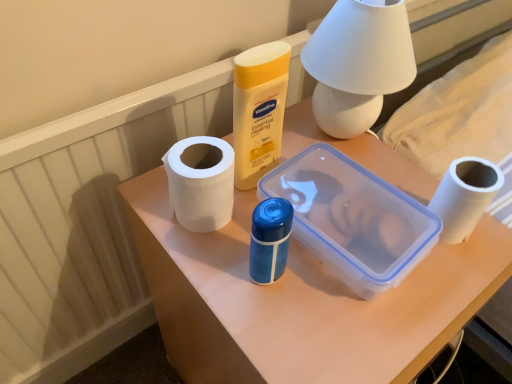
Question: Is the position of white matte paper towel at center-left less distant than that of white matte table lamp at upper center?

Choices:
 (A) no
 (B) yes

Answer: (A)

Question: Is white matte paper towel at center-left at the right side of white matte table lamp at upper center?

Choices:
 (A) yes
 (B) no

Answer: (B)

Question: From the image's perspective, does white matte paper towel at center-left appear higher than white matte table lamp at upper center?

Choices:
 (A) no
 (B) yes

Answer: (A)

Question: Is the depth of white matte paper towel at center-left greater than that of white matte table lamp at upper center?

Choices:
 (A) yes
 (B) no

Answer: (A)

Question: Considering the relative sizes of white matte paper towel at center-left and white matte table lamp at upper center in the image provided, is white matte paper towel at center-left smaller than white matte table lamp at upper center?

Choices:
 (A) yes
 (B) no

Answer: (A)

Question: In terms of height, does white textured radiator at lower left look taller or shorter compared to white matte toilet paper at right?

Choices:
 (A) short
 (B) tall

Answer: (B)

Question: Relative to white matte toilet paper at right, is white textured radiator at lower left in front or behind?

Choices:
 (A) front
 (B) behind

Answer: (A)

Question: From a real-world perspective, is white textured radiator at lower left physically located above or below white matte toilet paper at right?

Choices:
 (A) above
 (B) below

Answer: (B)

Question: From the image's perspective, is white textured radiator at lower left above or below white matte toilet paper at right?

Choices:
 (A) above
 (B) below

Answer: (A)

Question: From their relative heights in the image, would you say white textured radiator at lower left is taller or shorter than white matte paper towel at center-left?

Choices:
 (A) tall
 (B) short

Answer: (A)

Question: Is point (178, 107) positioned closer to the camera than point (179, 155)?

Choices:
 (A) farther
 (B) closer

Answer: (A)

Question: In terms of width, does white textured radiator at lower left look wider or thinner when compared to white matte paper towel at center-left?

Choices:
 (A) thin
 (B) wide

Answer: (A)

Question: Is white textured radiator at lower left spatially inside white matte paper towel at center-left, or outside of it?

Choices:
 (A) outside
 (B) inside

Answer: (A)

Question: Do you think white matte toilet paper at right is within white textured radiator at lower left, or outside of it?

Choices:
 (A) outside
 (B) inside

Answer: (A)

Question: In terms of height, does white matte toilet paper at right look taller or shorter compared to white textured radiator at lower left?

Choices:
 (A) tall
 (B) short

Answer: (B)